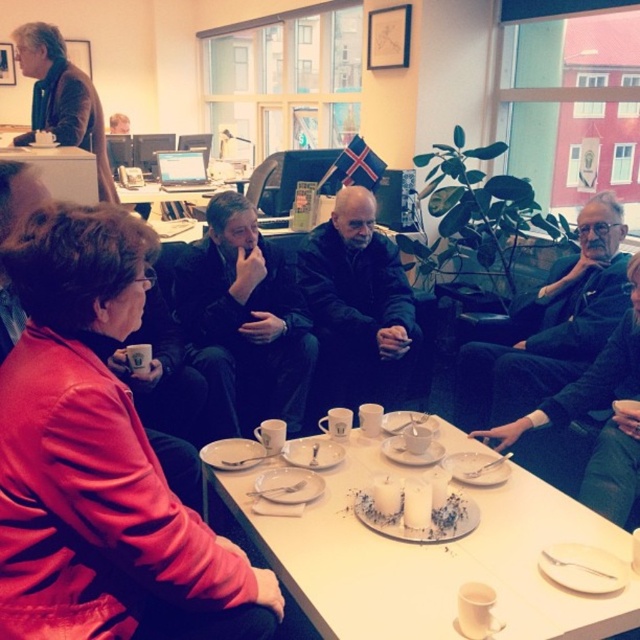
You are standing in the office scene and want to hand a document to the person wearing the dark gray suit at lower right. Considering your height is 1.7 meters, will you be able to reach them without moving closer?

The dark gray suit at lower right is 1.97 meters away from you. Since the distance is greater than your height of 1.7 meters, you cannot reach them without moving closer.